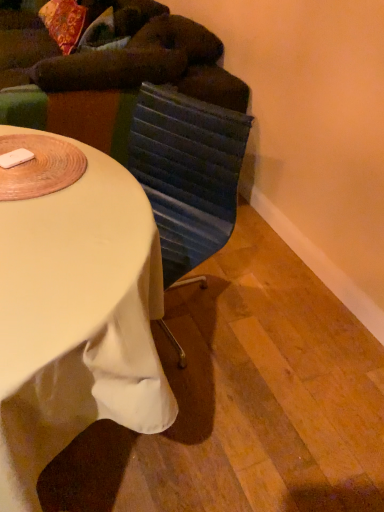
You are a GUI agent. You are given a task and a screenshot of the screen. Output one action in this format:
    pyautogui.click(x=<x>, y=<y>)
    Task: Click on the vacant point to the right of white fabric-covered desk at center
    This screenshot has height=512, width=384.
    Given the screenshot: What is the action you would take?
    pyautogui.click(x=270, y=376)